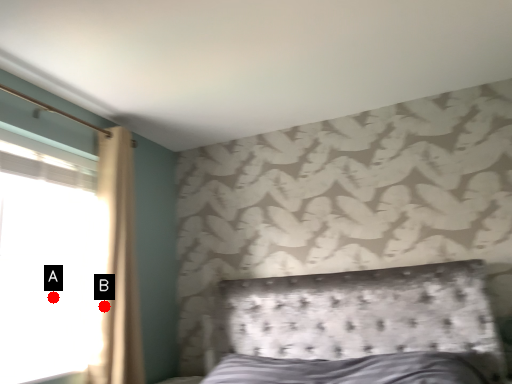
Question: Two points are circled on the image, labeled by A and B beside each circle. Among these points, which one is nearest to the camera?

Choices:
 (A) A is closer
 (B) B is closer

Answer: (B)